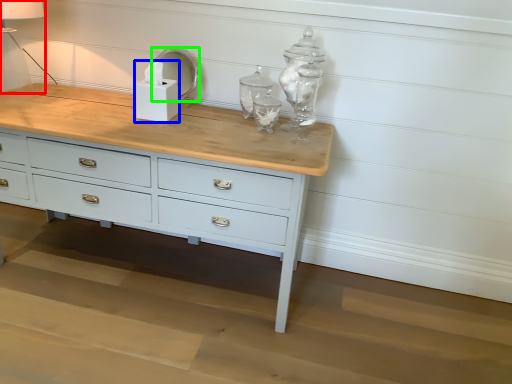
Question: Estimate the real-world distances between objects in this image. Which object is closer to table lamp (highlighted by a red box), candle holder (highlighted by a blue box) or mirror (highlighted by a green box)?

Choices:
 (A) candle holder
 (B) mirror

Answer: (B)